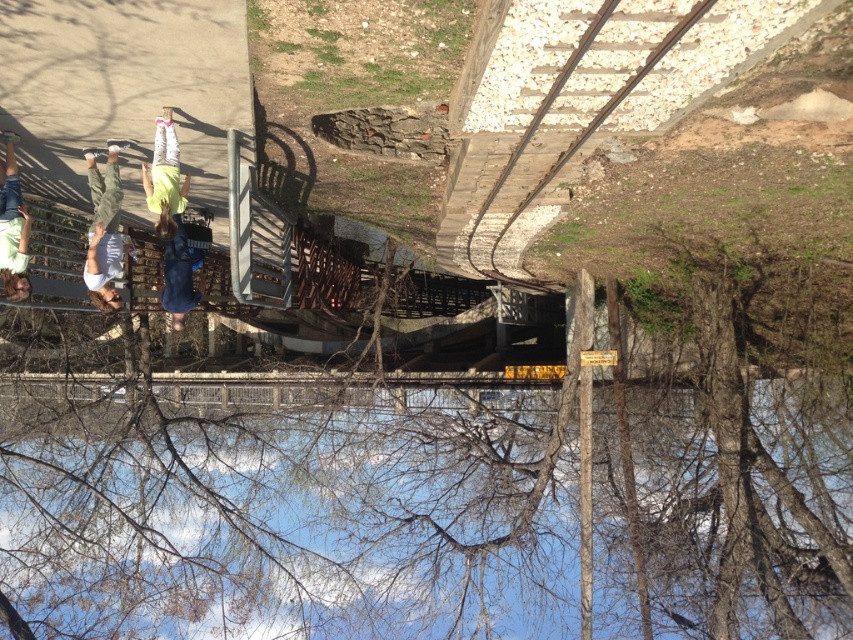
Question: Which object appears farthest from the camera in this image?

Choices:
 (A) denim shorts at center
 (B) light green fabric pants at center
 (C) wooden planks at upper right
 (D) light green shirt at left

Answer: (A)

Question: Which object is the closest to the light green shirt at left?

Choices:
 (A) green fabric pants at left
 (B) wooden planks at upper right
 (C) light green fabric pants at center

Answer: (A)

Question: Does light green fabric pants at center appear on the left side of denim shorts at center?

Choices:
 (A) yes
 (B) no

Answer: (B)

Question: Which point is farther to the camera?

Choices:
 (A) (19, 227)
 (B) (183, 256)
 (C) (650, 65)

Answer: (B)

Question: Where is wooden planks at upper right located in relation to light green fabric pants at center in the image?

Choices:
 (A) above
 (B) below

Answer: (A)

Question: Can you confirm if wooden planks at upper right is positioned below denim shorts at center?

Choices:
 (A) yes
 (B) no

Answer: (B)